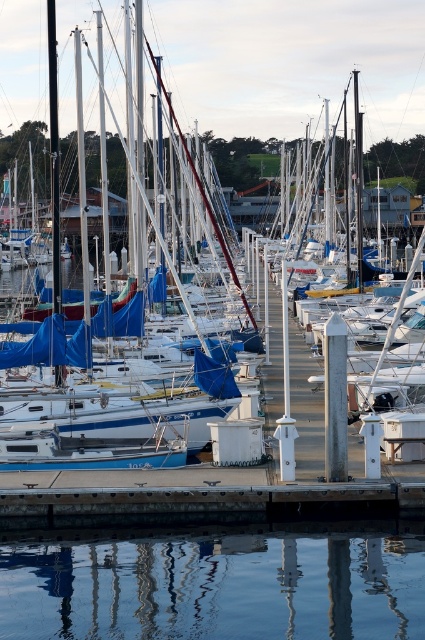
You are standing at the edge of the marina looking out at the water. There are two points of interest marked in the scene, one at point coordinates point (320,561) and another at point coordinates point (144,474). Which point is closer to you?

Point (320,561) is closer to the camera than point (144,474).

You are standing on the dock and looking at the transparent water at center and the blue tarpaulin sailboat at center. Which object is taller from your viewpoint?

The blue tarpaulin sailboat at center is taller than the transparent water at center, so the blue tarpaulin sailboat at center is taller from your viewpoint.